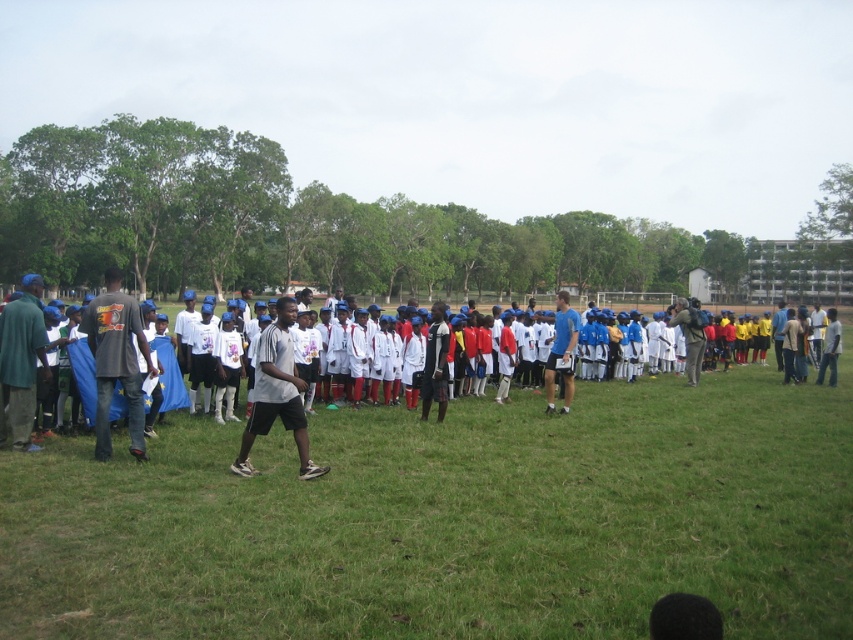
Identify the location of green grass at center. The width and height of the screenshot is (853, 640). (451, 518).

Can you confirm if green grass at center is thinner than white matte shorts at center?

In fact, green grass at center might be wider than white matte shorts at center.

Does point (215, 500) come closer to viewer compared to point (271, 417)?

That is True.

Locate an element on the screen. This screenshot has height=640, width=853. green grass at center is located at coordinates (451, 518).

Between point (660, 456) and point (254, 426), which one is positioned behind?

The point (660, 456) is behind.

Between white matte shirt at center and white matte shorts at center, which one is positioned lower?

white matte shirt at center is below.

The height and width of the screenshot is (640, 853). Describe the element at coordinates (492, 465) in the screenshot. I see `white matte shirt at center` at that location.

The image size is (853, 640). Identify the location of white matte shirt at center. (492, 465).

Is point (134, 396) farther from camera compared to point (276, 408)?

Yes, it is.

Is black matte shirt at left thinner than white matte shorts at center?

Yes.

Which is behind, point (94, 298) or point (263, 422)?

Point (94, 298)

I want to click on black matte shirt at left, so coord(115,362).